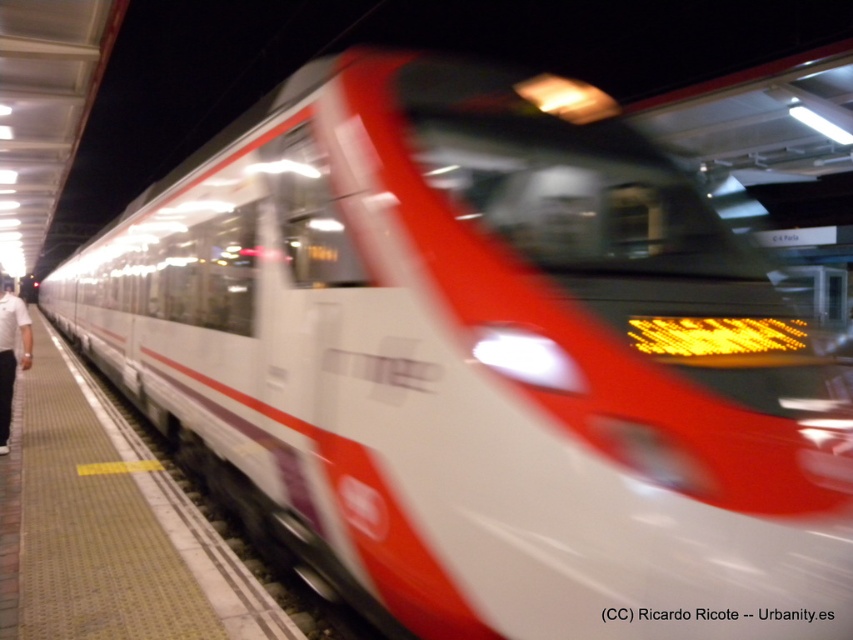
You are a passenger waiting at the train station. You see the yellow textured platform at lower left and the white cotton shirt at left. Which object is closer to the ground?

The yellow textured platform at lower left is positioned under the white cotton shirt at left, meaning it is closer to the ground.

You are a passenger waiting at the train station. You see the yellow textured platform at lower left and the white cotton shirt at left. Which object is closer to the right side of the image?

The yellow textured platform at lower left is to the right of the white cotton shirt at left, so the yellow textured platform at lower left is closer to the right side of the image.

You are a passenger at the train station and want to board the train. You see the yellow textured platform at lower left and the white cotton shirt at left. Which object is narrower?

The yellow textured platform at lower left has a lesser width compared to the white cotton shirt at left, so the yellow textured platform at lower left is narrower.